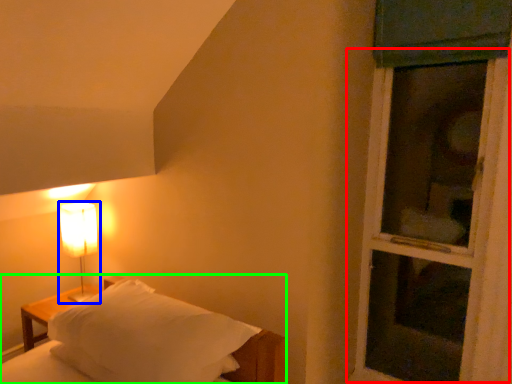
Question: Which object is positioned farthest from screen door (highlighted by a red box)? Select from lamp (highlighted by a blue box) and bed (highlighted by a green box).

Choices:
 (A) lamp
 (B) bed

Answer: (A)